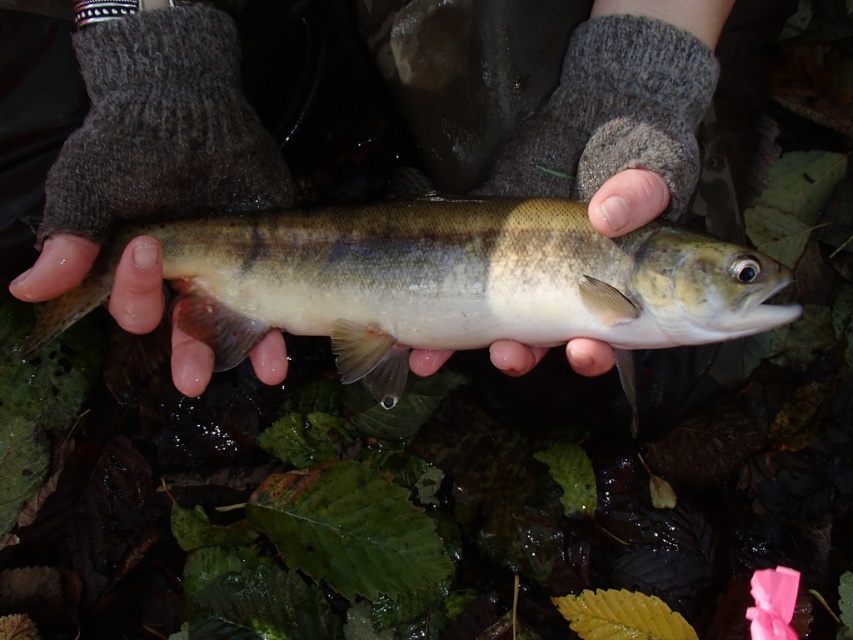
You are a biologist observing a trout in a natural habitat. You notice a shiny silver fish at center and a smooth skin hand at center. Based on their sizes, which one is more likely to be the actual trout?

The shiny silver fish at center is more likely to be the actual trout because it has a larger size compared to the smooth skin hand at center.

In the scene shown: You are a photographer trying to capture a closeup shot of the shiny silver fish at center while also including the smooth skin hand at center in the frame. Given that your camera has a minimum focusing distance of 3 inches, will you be able to achieve this shot without moving the camera closer?

The shiny silver fish at center and smooth skin hand at center are 3.71 inches apart from each other. Since the minimum focusing distance is 3 inches, the camera can focus on both objects as the distance between them is within the focusing range. Therefore, you can achieve the shot without moving the camera closer.